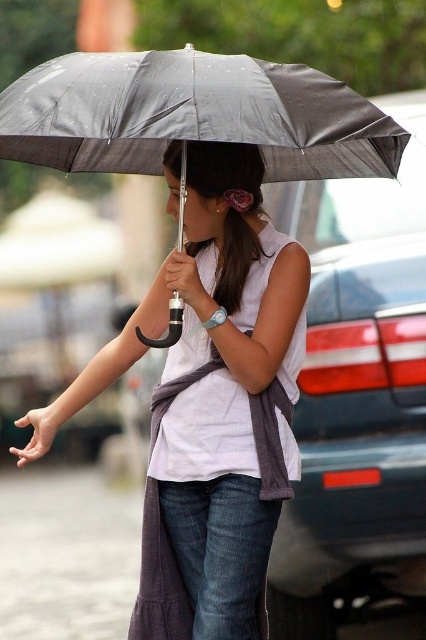
Measure the distance between matte gray umbrella at upper center and camera.

matte gray umbrella at upper center is 4.12 meters from camera.

Does matte gray umbrella at upper center appear on the right side of metallic gray umbrella at center?

No, matte gray umbrella at upper center is not to the right of metallic gray umbrella at center.

Is point (284, 477) positioned in front of point (91, 113)?

No.

The image size is (426, 640). I want to click on matte gray umbrella at upper center, so click(212, 403).